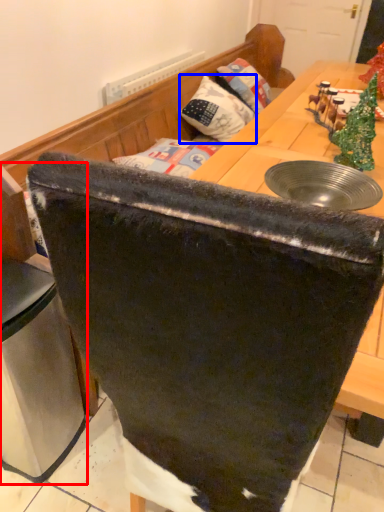
Question: Which object is further to the camera taking this photo, leftover (highlighted by a red box) or pillow (highlighted by a blue box)?

Choices:
 (A) leftover
 (B) pillow

Answer: (B)